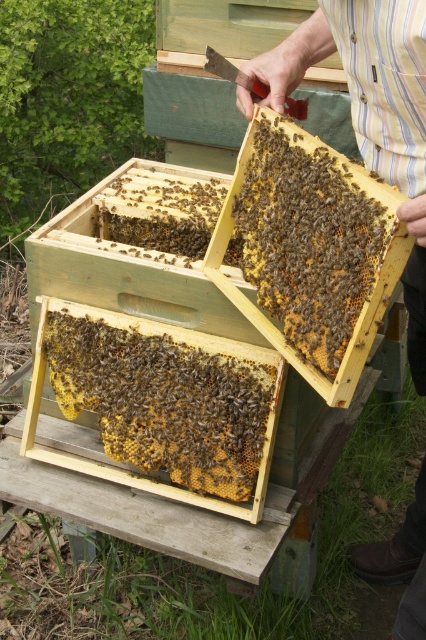
Question: Can you confirm if brown wax comb at center is bigger than brown fuzzy honeycomb at center?

Choices:
 (A) yes
 (B) no

Answer: (A)

Question: Based on their relative distances, which object is nearer to the brown fuzzy honeycomb at center?

Choices:
 (A) brown wax comb at center
 (B) beehive at center
 (C) striped cotton shirt at upper center

Answer: (A)

Question: Among these points, which one is nearest to the camera?

Choices:
 (A) pyautogui.click(x=365, y=308)
 (B) pyautogui.click(x=284, y=369)
 (C) pyautogui.click(x=411, y=305)

Answer: (A)

Question: Is striped cotton shirt at upper center wider than brown fuzzy honeycomb at center?

Choices:
 (A) no
 (B) yes

Answer: (B)

Question: Where is striped cotton shirt at upper center located in relation to brown fuzzy honeycomb at center in the image?

Choices:
 (A) left
 (B) right

Answer: (B)

Question: Which of the following is the closest to the observer?

Choices:
 (A) striped cotton shirt at upper center
 (B) brown wax comb at center

Answer: (A)